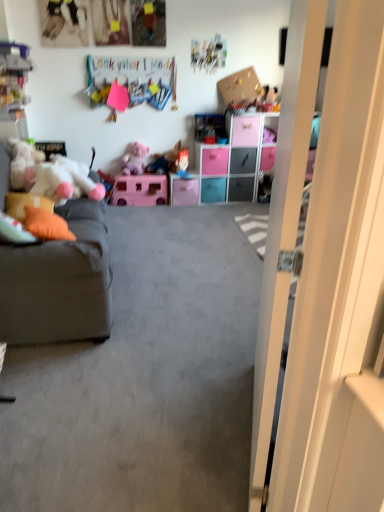
Identify the location of vacant region to the left of white glossy door at right. (160, 423).